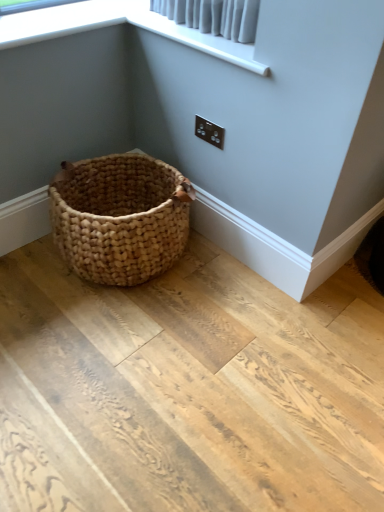
Where is `black plastic electric outlet at upper right`? The height and width of the screenshot is (512, 384). black plastic electric outlet at upper right is located at coordinates (209, 132).

The width and height of the screenshot is (384, 512). Describe the element at coordinates (209, 132) in the screenshot. I see `black plastic electric outlet at upper right` at that location.

In order to face white fabric at upper center, should I rotate leftwards or rightwards?

Turn left approximately 1.139 degrees to face it.

Identify the location of white fabric at upper center. (119, 23).

What do you see at coordinates (119, 23) in the screenshot? This screenshot has width=384, height=512. I see `white fabric at upper center` at bounding box center [119, 23].

Where is `black plastic electric outlet at upper right`? Image resolution: width=384 pixels, height=512 pixels. black plastic electric outlet at upper right is located at coordinates (209, 132).

Is white fabric at upper center at the right side of black plastic electric outlet at upper right?

No, white fabric at upper center is not to the right of black plastic electric outlet at upper right.

Between white fabric at upper center and black plastic electric outlet at upper right, which one is positioned in front?

white fabric at upper center is more forward.

Which point is more forward, (180, 42) or (220, 138)?

Point (180, 42)

From the picture: From the image's perspective, who appears lower, white fabric at upper center or black plastic electric outlet at upper right?

black plastic electric outlet at upper right appears lower in the image.

From a real-world perspective, does white fabric at upper center stand above black plastic electric outlet at upper right?

Yes.

Which of these two, white fabric at upper center or black plastic electric outlet at upper right, is wider?

A: white fabric at upper center.

Looking at this image, which of these two, white fabric at upper center or black plastic electric outlet at upper right, stands taller?

Standing taller between the two is black plastic electric outlet at upper right.

Can you confirm if white fabric at upper center is bigger than black plastic electric outlet at upper right?

Yes.

Choose the correct answer: Is white fabric at upper center inside black plastic electric outlet at upper right or outside it?

The correct answer is: outside.

Is white fabric at upper center with black plastic electric outlet at upper right?

white fabric at upper center is not next to black plastic electric outlet at upper right, and they're not touching.

Could you tell me if white fabric at upper center is facing black plastic electric outlet at upper right?

No, white fabric at upper center is not turned towards black plastic electric outlet at upper right.

How different are the orientations of white fabric at upper center and black plastic electric outlet at upper right in degrees?

The angular difference between white fabric at upper center and black plastic electric outlet at upper right is 1.62 degrees.

How much distance is there between white fabric at upper center and black plastic electric outlet at upper right?

white fabric at upper center and black plastic electric outlet at upper right are 42.57 centimeters apart.

Image resolution: width=384 pixels, height=512 pixels. Find the location of `electric outlet located below the white fabric at upper center (from the image's perspective)`. electric outlet located below the white fabric at upper center (from the image's perspective) is located at coordinates (209, 132).

Considering the positions of objects black plastic electric outlet at upper right and white fabric at upper center in the image provided, who is more to the right, black plastic electric outlet at upper right or white fabric at upper center?

Positioned to the right is black plastic electric outlet at upper right.

Considering their positions, is black plastic electric outlet at upper right located in front of or behind white fabric at upper center?

In the image, black plastic electric outlet at upper right appears behind white fabric at upper center.

Is point (210, 132) farther from viewer compared to point (170, 27)?

Yes, it is behind point (170, 27).

From the image's perspective, is black plastic electric outlet at upper right above or below white fabric at upper center?

Based on their image positions, black plastic electric outlet at upper right is located beneath white fabric at upper center.

From a real-world perspective, which is physically below, black plastic electric outlet at upper right or white fabric at upper center?

black plastic electric outlet at upper right.

Does black plastic electric outlet at upper right have a greater width compared to white fabric at upper center?

Incorrect, the width of black plastic electric outlet at upper right does not surpass that of white fabric at upper center.

Can you confirm if black plastic electric outlet at upper right is shorter than white fabric at upper center?

No.

Is black plastic electric outlet at upper right smaller than white fabric at upper center?

Yes, black plastic electric outlet at upper right is smaller than white fabric at upper center.

Choose the correct answer: Is black plastic electric outlet at upper right inside white fabric at upper center or outside it?

black plastic electric outlet at upper right is not inside white fabric at upper center, it's outside.

From the picture: Does black plastic electric outlet at upper right touch white fabric at upper center?

No, black plastic electric outlet at upper right is not with white fabric at upper center.

Is black plastic electric outlet at upper right facing away from white fabric at upper center?

No, black plastic electric outlet at upper right's orientation is not away from white fabric at upper center.

How far apart are black plastic electric outlet at upper right and white fabric at upper center?

black plastic electric outlet at upper right and white fabric at upper center are 16.76 inches apart.

This screenshot has width=384, height=512. I want to click on window screen in front of the black plastic electric outlet at upper right, so click(x=119, y=23).

There is a black plastic electric outlet at upper right. Where is `window screen above it (from a real-world perspective)`? Image resolution: width=384 pixels, height=512 pixels. window screen above it (from a real-world perspective) is located at coordinates (119, 23).

Locate an element on the screen. window screen on the left of black plastic electric outlet at upper right is located at coordinates (119, 23).